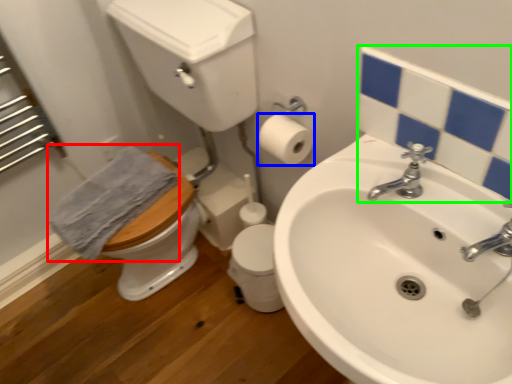
Question: Considering the real-world distances, which object is farthest from bath towel (highlighted by a red box)? toilet paper (highlighted by a blue box) or mirror (highlighted by a green box)?

Choices:
 (A) toilet paper
 (B) mirror

Answer: (B)